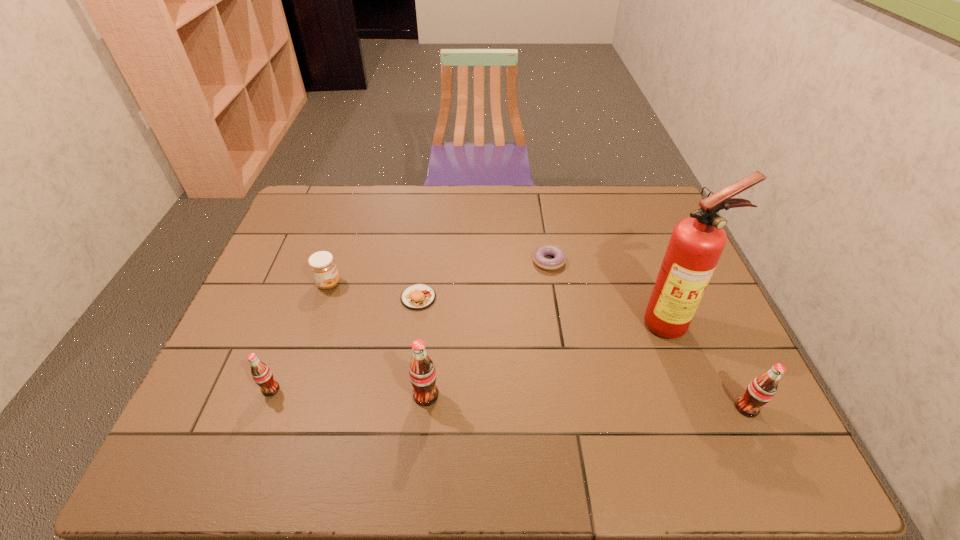
The width and height of the screenshot is (960, 540). I want to click on the leftmost soda, so click(261, 373).

Identify the location of the shortest soda. Image resolution: width=960 pixels, height=540 pixels. (261, 373).

Where is `the tallest soda`? the tallest soda is located at coordinates (422, 373).

The height and width of the screenshot is (540, 960). In order to click on the sixth shortest object in this screenshot , I will do `click(422, 373)`.

Where is `the fifth shortest object`? the fifth shortest object is located at coordinates (761, 390).

Locate an element on the screen. The height and width of the screenshot is (540, 960). the rightmost soda is located at coordinates (761, 390).

Identify the location of the fifth object from left to right. (559, 259).

You are a GUI agent. You are given a task and a screenshot of the screen. Output one action in this format:
    pyautogui.click(x=<x>, y=<y>)
    Task: Click on the shortest object
    This screenshot has width=960, height=540.
    Given the screenshot: What is the action you would take?
    pyautogui.click(x=559, y=259)

Locate an element on the screen. This screenshot has height=540, width=960. the fifth tallest object is located at coordinates (322, 264).

Identify the location of patty. (418, 296).